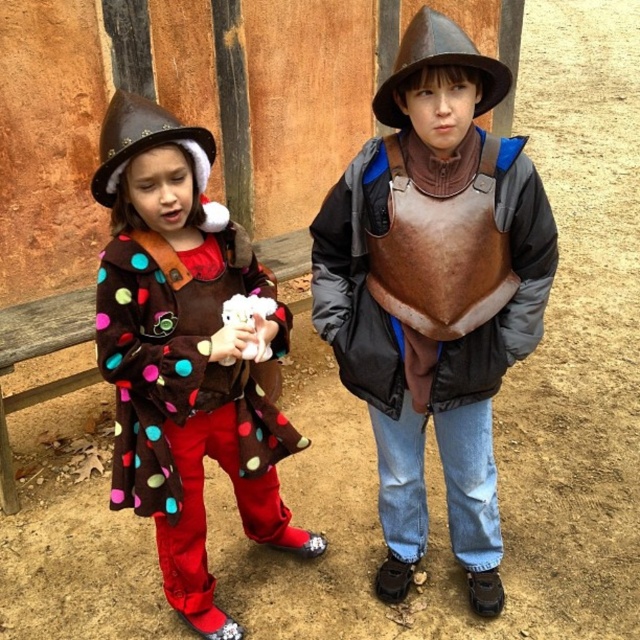
Question: Is brown leather armor at center further to the viewer compared to brown felt cowboy hat at left?

Choices:
 (A) no
 (B) yes

Answer: (A)

Question: Among these points, which one is nearest to the camera?

Choices:
 (A) (189, 513)
 (B) (140, 124)
 (C) (451, 36)

Answer: (C)

Question: Which object is closer to the camera taking this photo?

Choices:
 (A) polka dot fleece coat at center
 (B) brown leather armor at center
 (C) brown felt cowboy hat at left
 (D) brown leather hat at upper center

Answer: (D)

Question: Is polka dot fleece coat at center bigger than brown leather hat at upper center?

Choices:
 (A) no
 (B) yes

Answer: (B)

Question: Does brown leather armor at center lie behind brown leather hat at upper center?

Choices:
 (A) no
 (B) yes

Answer: (B)

Question: Among these points, which one is farthest from the camera?

Choices:
 (A) (154, 125)
 (B) (186, 312)
 (C) (451, 49)

Answer: (B)